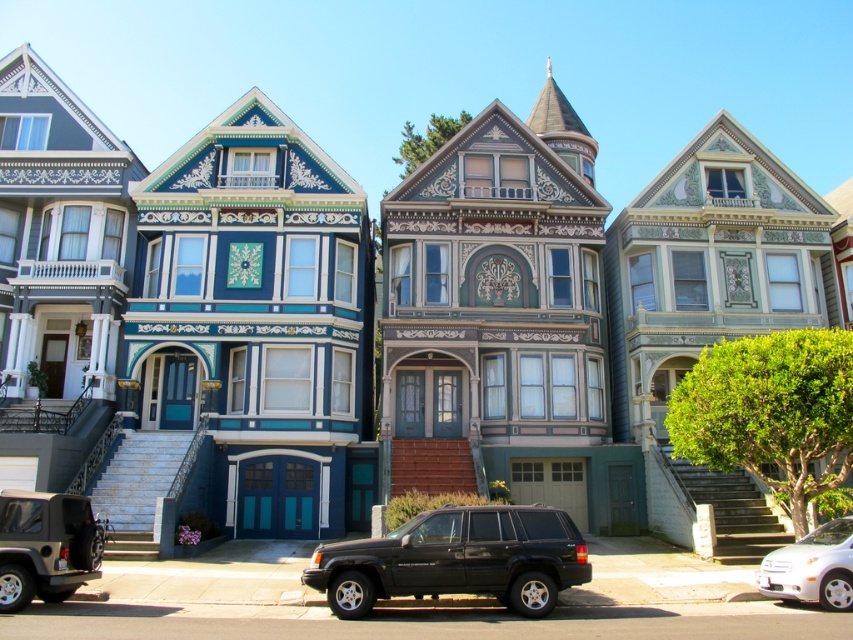
You are driving a matte black suv at lower left and want to exit the row of Victorian houses. Since you need to pass the matte black suv at center, can you do so without moving it?

The matte black suv at lower left is behind the matte black suv at center, so you can exit by driving around it since it is in front of you.

You are standing at the origin point of the coordinate system where the bottom left corner of the image is the origin. The image has a coordinate system where the x and y axes go from 0 to 1. You want to locate the matte black suv at center. What are its coordinates?

The coordinates of the matte black suv at center are at point [456,560].

You are a delivery driver needing to park your vehicle between the matte black suv at center and the white glossy sedan at lower right. Is there enough space between them for your truck, which is 2 meters wide?

The matte black suv at center is to the left of white glossy sedan at lower right. However, the distance between them isn not specified in the objects description, so it is impossible to determine if there is enough space for a 2 meter wide truck.